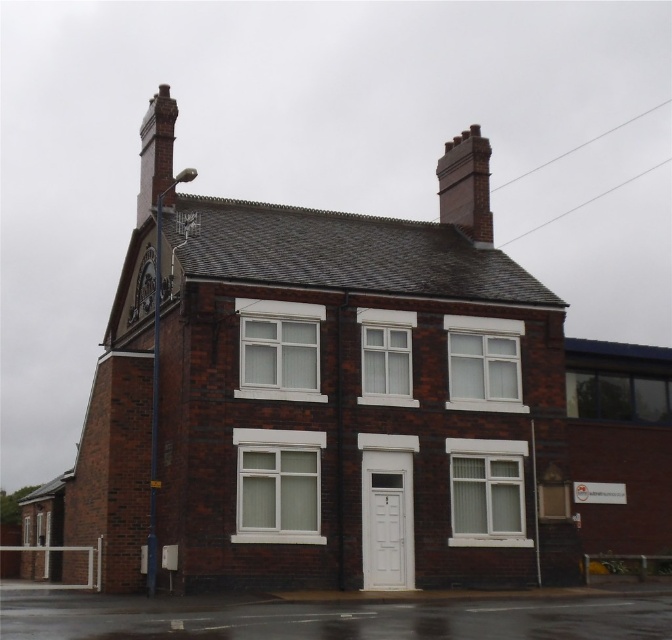
Between dark red brick chimney at center and brick chimney at upper right, which one appears on the left side from the viewer's perspective?

From the viewer's perspective, dark red brick chimney at center appears more on the left side.

Which is in front, point (151, 220) or point (452, 211)?

Point (151, 220)

At what (x,y) coordinates should I click in order to perform the action: click on dark red brick chimney at center. Please return your answer as a coordinate pair (x, y). This screenshot has height=640, width=672. Looking at the image, I should click on (325, 406).

Can you confirm if dark red brick chimney at center is taller than red brick chimney at upper left?

In fact, dark red brick chimney at center may be shorter than red brick chimney at upper left.

Does point (413, 560) come behind point (153, 193)?

That is False.

Where is `dark red brick chimney at center`? dark red brick chimney at center is located at coordinates (325, 406).

Locate an element on the screen. brick chimney at upper right is located at coordinates (466, 186).

From the picture: Who is shorter, brick chimney at upper right or red brick chimney at upper left?

A: brick chimney at upper right is shorter.

I want to click on brick chimney at upper right, so click(x=466, y=186).

Find the location of a particular element. brick chimney at upper right is located at coordinates (466, 186).